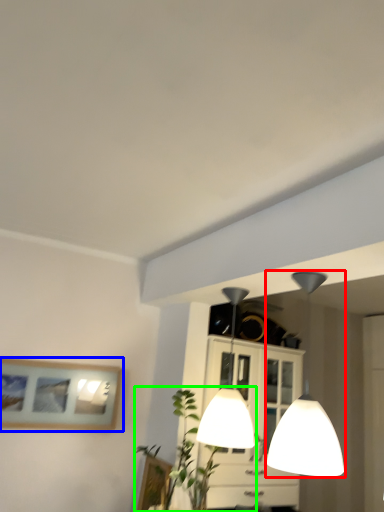
Question: Estimate the real-world distances between objects in this image. Which object is farther from lamp (highlighted by a red box), picture frame (highlighted by a blue box) or plant (highlighted by a green box)?

Choices:
 (A) picture frame
 (B) plant

Answer: (A)